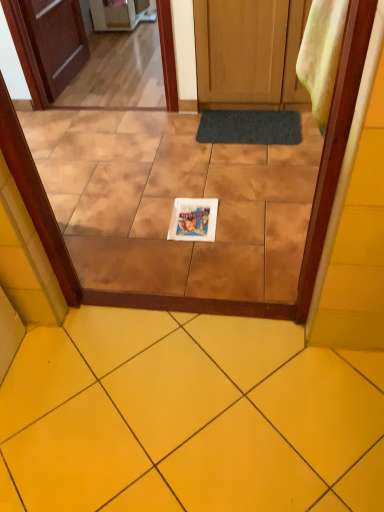
Question: Can you confirm if white glossy magazine at center is bigger than yellow ceramic tile at center?

Choices:
 (A) no
 (B) yes

Answer: (A)

Question: Is white glossy magazine at center positioned with its back to yellow ceramic tile at center?

Choices:
 (A) no
 (B) yes

Answer: (A)

Question: Is white glossy magazine at center directly adjacent to yellow ceramic tile at center?

Choices:
 (A) no
 (B) yes

Answer: (A)

Question: From a real-world perspective, does white glossy magazine at center sit lower than yellow ceramic tile at center?

Choices:
 (A) yes
 (B) no

Answer: (A)

Question: Does white glossy magazine at center have a lesser width compared to yellow ceramic tile at center?

Choices:
 (A) yes
 (B) no

Answer: (A)

Question: Considering the positions of white glossy magazine at center and yellow ceramic tile at center in the image, is white glossy magazine at center taller or shorter than yellow ceramic tile at center?

Choices:
 (A) short
 (B) tall

Answer: (A)

Question: Considering the positions of point (208, 200) and point (125, 403), is point (208, 200) closer or farther from the camera than point (125, 403)?

Choices:
 (A) closer
 (B) farther

Answer: (B)

Question: Looking at the image, does white glossy magazine at center seem bigger or smaller compared to yellow ceramic tile at center?

Choices:
 (A) big
 (B) small

Answer: (B)

Question: From the image's perspective, is white glossy magazine at center above or below yellow ceramic tile at center?

Choices:
 (A) above
 (B) below

Answer: (A)

Question: In the image, is yellow ceramic tile at center positioned in front of or behind dark gray textured mat at center?

Choices:
 (A) front
 (B) behind

Answer: (A)

Question: Choose the correct answer: Is yellow ceramic tile at center inside dark gray textured mat at center or outside it?

Choices:
 (A) inside
 (B) outside

Answer: (B)

Question: Based on their sizes in the image, would you say yellow ceramic tile at center is bigger or smaller than dark gray textured mat at center?

Choices:
 (A) small
 (B) big

Answer: (B)

Question: From the image's perspective, is yellow ceramic tile at center located above or below dark gray textured mat at center?

Choices:
 (A) below
 (B) above

Answer: (A)

Question: In terms of size, does white glossy magazine at center appear bigger or smaller than dark gray textured mat at center?

Choices:
 (A) big
 (B) small

Answer: (B)

Question: From the image's perspective, is white glossy magazine at center located above or below dark gray textured mat at center?

Choices:
 (A) below
 (B) above

Answer: (A)